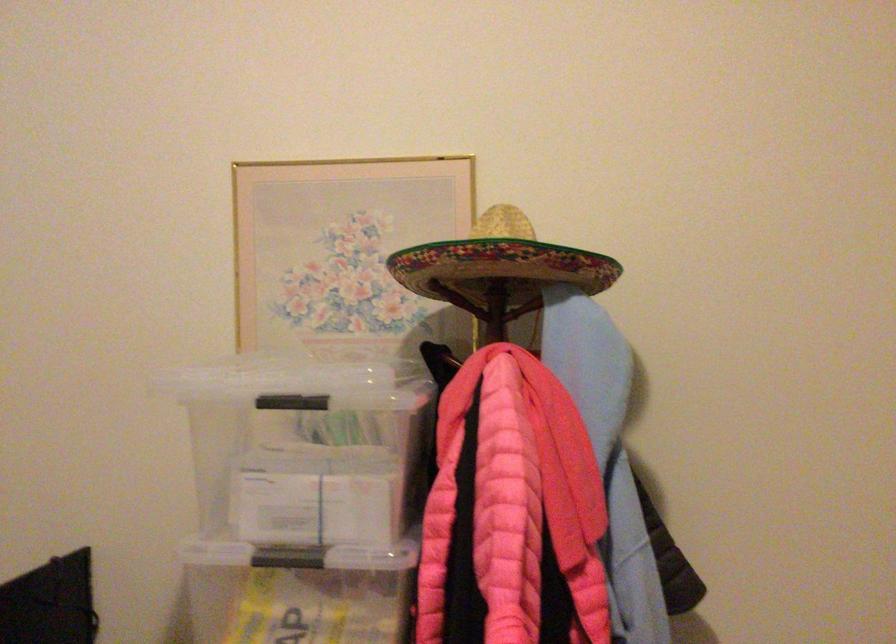
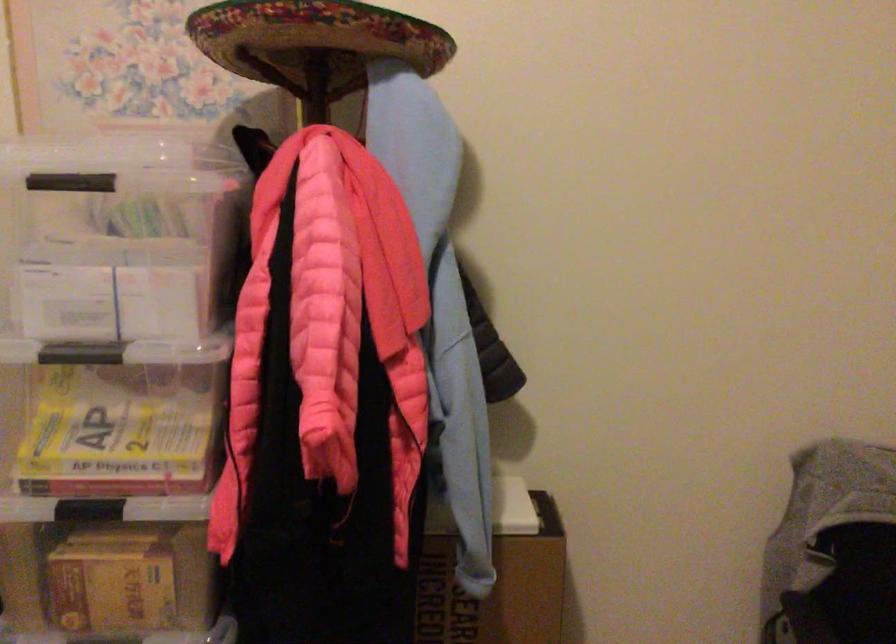
Question: How did the camera likely rotate?

Choices:
 (A) Left
 (B) Right
 (C) Up
 (D) Down

Answer: (D)